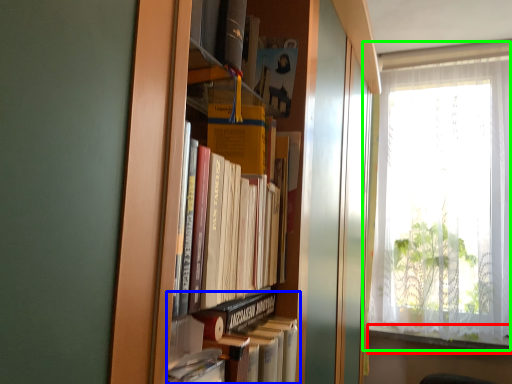
Question: Based on their relative distances, which object is farther from window sill (highlighted by a red box)? Choose from book (highlighted by a blue box) and window (highlighted by a green box).

Choices:
 (A) book
 (B) window

Answer: (A)